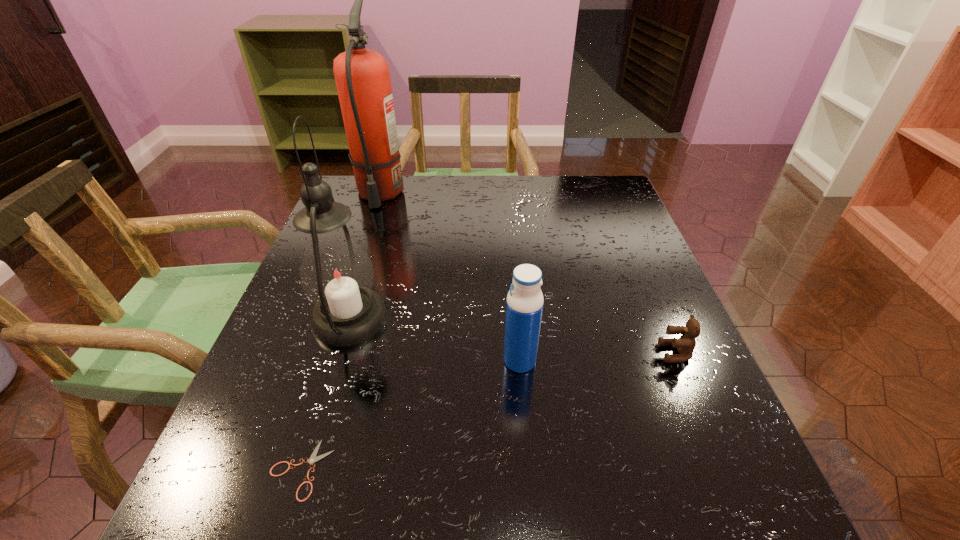
This screenshot has height=540, width=960. Find the location of `fire extinguisher`. fire extinguisher is located at coordinates (362, 76).

Locate an element on the screen. The height and width of the screenshot is (540, 960). oil lamp is located at coordinates (336, 273).

I want to click on the third shortest object, so click(524, 305).

Locate an element on the screen. The height and width of the screenshot is (540, 960). water bottle is located at coordinates (524, 305).

The height and width of the screenshot is (540, 960). I want to click on teddy bear, so pos(685,345).

Where is `the rightmost object`? The width and height of the screenshot is (960, 540). the rightmost object is located at coordinates (685, 345).

Image resolution: width=960 pixels, height=540 pixels. I want to click on the nearest object, so click(x=313, y=458).

At what (x,y) coordinates should I click in order to perform the action: click on shears. Please return your answer as a coordinate pair (x, y). The height and width of the screenshot is (540, 960). Looking at the image, I should click on (313, 458).

Where is `free space located 0.310m on the nozzle of the farthest object`? free space located 0.310m on the nozzle of the farthest object is located at coordinates (346, 296).

Find the location of a particular element. Image resolution: width=960 pixels, height=540 pixels. free spot located on the back of the oil lamp is located at coordinates (366, 266).